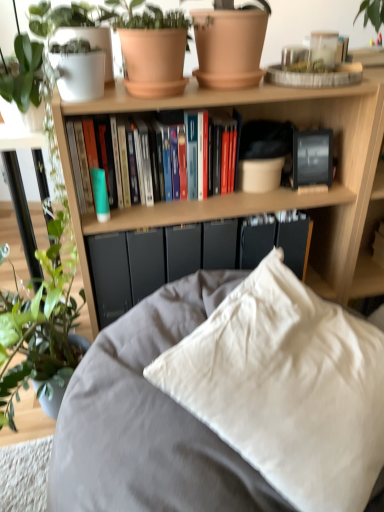
Question: In the image, is wooden bookcase at upper center on the left side or the right side of terracotta clay pot at upper center, the 2th flowerpot viewed from the right?

Choices:
 (A) left
 (B) right

Answer: (B)

Question: Looking at their shapes, would you say wooden bookcase at upper center is wider or thinner than terracotta clay pot at upper center, the 1th flowerpot positioned from the left?

Choices:
 (A) thin
 (B) wide

Answer: (B)

Question: Which of these objects is positioned farthest from the green glossy plant at left?

Choices:
 (A) terracotta clay pot at upper center, which is the 1th flowerpot in right-to-left order
 (B) matte black paperback book at center, marked as the second paperback book in a right-to-left arrangement
 (C) wooden bookcase at upper center
 (D) hardcover books at center
 (E) matte black paperback book at center, the 1th paperback book viewed from the right

Answer: (E)

Question: Estimate the real-world distances between objects in this image. Which object is closer to the white cotton pillow at center?

Choices:
 (A) terracotta clay pot at upper center, the 2th flowerpot viewed from the right
 (B) hardcover books at center
 (C) green glossy plant at left
 (D) terracotta clay pot at upper center, which is the 1th flowerpot in right-to-left order
 (E) matte black paperback book at center, which appears as the 1th paperback book when viewed from the left

Answer: (E)